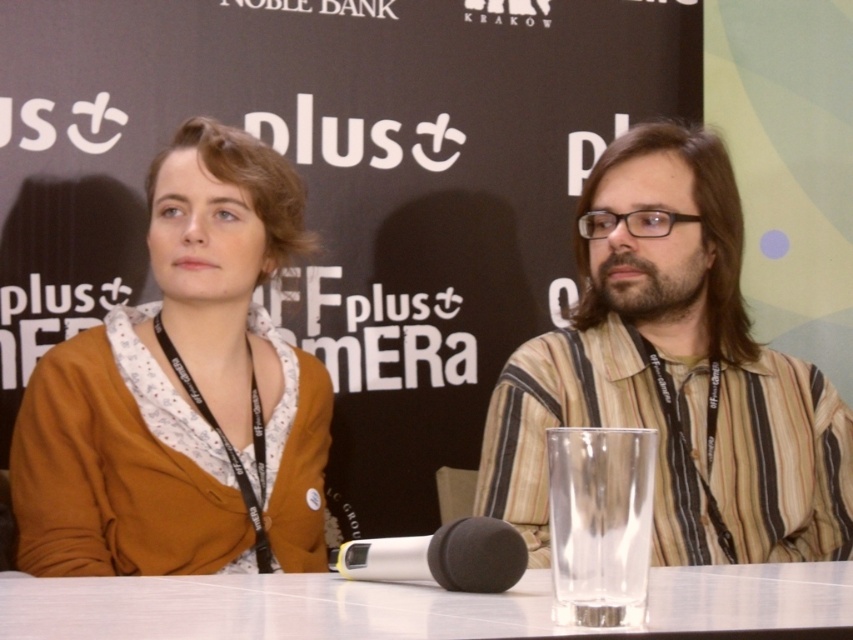
You are a photographer setting up for a panel discussion. You need to ensure that the matte brown cardigan at center and the clear glass table at center are visible in the photo. Given their heights, which object might block the view of the other when positioned behind it?

The matte brown cardigan at center is much taller than the clear glass table at center, so if placed behind the cardigan, the table might be partially obscured. Conversely, placing the cardigan behind the table would be problematic due to its greater height, making the table unable to hide it.

You are a photographer at the event and need to focus your camera on the striped cotton shirt at center. What are the coordinates where you should aim your camera?

You should aim your camera at the coordinates point (674, 372) to focus on the striped cotton shirt at center.